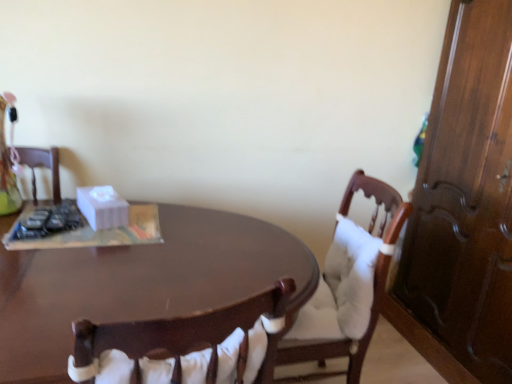
Question: Would you consider shiny brown desk at center to be distant from white matte tissue box at center?

Choices:
 (A) yes
 (B) no

Answer: (B)

Question: Considering the relative sizes of shiny brown desk at center and white matte tissue box at center in the image provided, is shiny brown desk at center thinner than white matte tissue box at center?

Choices:
 (A) yes
 (B) no

Answer: (B)

Question: From a real-world perspective, does shiny brown desk at center stand above white matte tissue box at center?

Choices:
 (A) yes
 (B) no

Answer: (B)

Question: Is white matte tissue box at center at the back of shiny brown desk at center?

Choices:
 (A) yes
 (B) no

Answer: (B)

Question: Does shiny brown desk at center have a greater width compared to white matte tissue box at center?

Choices:
 (A) yes
 (B) no

Answer: (A)

Question: In terms of height, does shiny brown desk at center look taller or shorter compared to white matte tissue box at center?

Choices:
 (A) tall
 (B) short

Answer: (A)

Question: From a real-world perspective, is shiny brown desk at center positioned above or below white matte tissue box at center?

Choices:
 (A) below
 (B) above

Answer: (A)

Question: Considering their positions, is shiny brown desk at center located in front of or behind white matte tissue box at center?

Choices:
 (A) behind
 (B) front

Answer: (B)

Question: Would you say shiny brown desk at center is to the left or to the right of white matte tissue box at center in the picture?

Choices:
 (A) left
 (B) right

Answer: (B)

Question: Choose the correct answer: Is white matte tissue box at center inside shiny brown desk at center or outside it?

Choices:
 (A) outside
 (B) inside

Answer: (A)

Question: In the image, is white matte tissue box at center on the left side or the right side of shiny brown desk at center?

Choices:
 (A) right
 (B) left

Answer: (B)

Question: Is white matte tissue box at center in front of or behind shiny brown desk at center in the image?

Choices:
 (A) behind
 (B) front

Answer: (A)

Question: From the image's perspective, is white matte tissue box at center positioned above or below shiny brown desk at center?

Choices:
 (A) above
 (B) below

Answer: (A)

Question: Is white matte tissue box at center bigger or smaller than wooden chair with white cushion at center?

Choices:
 (A) small
 (B) big

Answer: (A)

Question: Relative to wooden chair with white cushion at center, is white matte tissue box at center in front or behind?

Choices:
 (A) behind
 (B) front

Answer: (A)